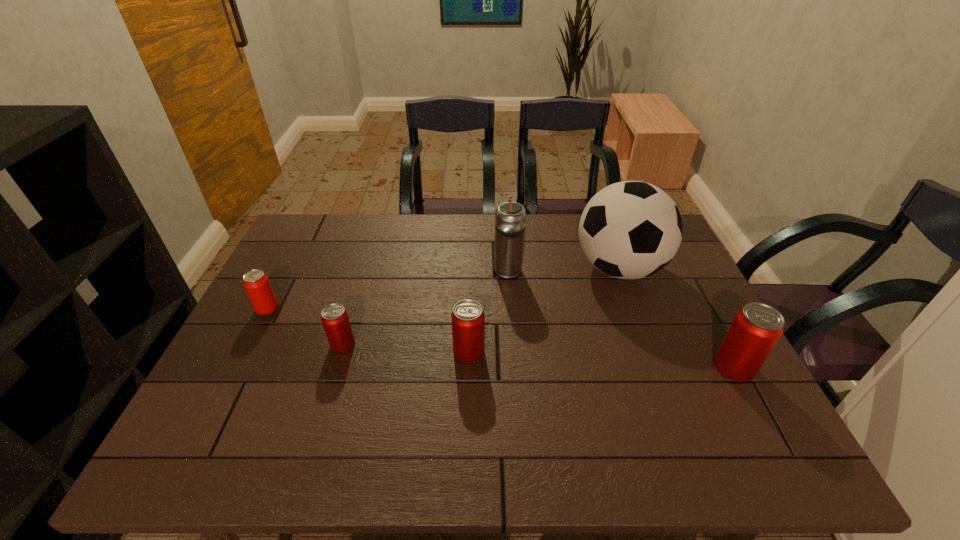
Please mark a free spot for a new can to balance the arrangement. Please provide its 2D coordinates. Your answer should be formatted as a tuple, i.e. [(x, y)], where the tuple contains the x and y coordinates of a point satisfying the conditions above.

[(599, 360)]